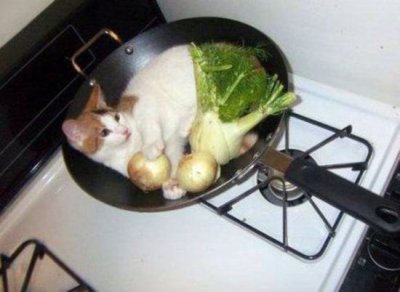
Find the location of a particular element. This screenshot has width=400, height=292. front right burner is located at coordinates (285, 208).